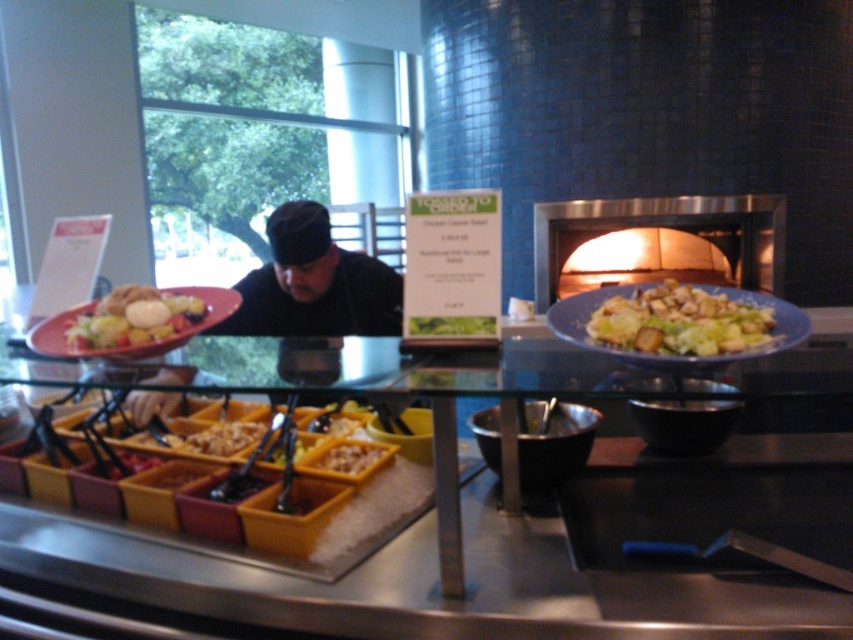
You are a customer at the buffet station and want to grab a salad. You notice the black fabric at center and the green leafy vegetable at center. Which object is closer to your right side when facing the food station?

The green leafy vegetable at center is closer to your right side because the black fabric at center is to the left of it.

You are a customer at the buffet and want to grab both the matte brown croutons at center and the yellow plastic tray at center. Which object should you reach for first to get the one that is closer to you?

The matte brown croutons at center is closer to the viewer than the yellow plastic tray at center, so you should reach for the matte brown croutons at center first.